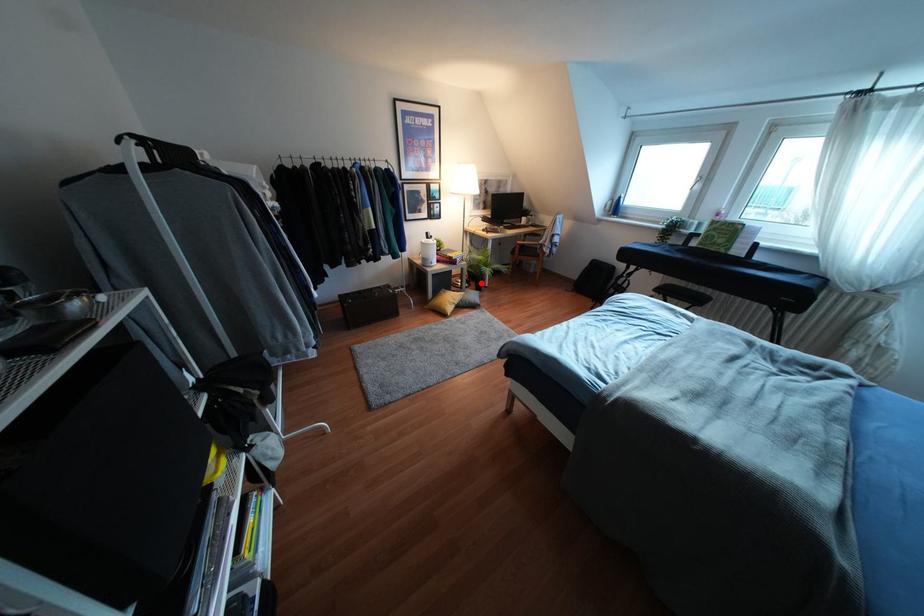
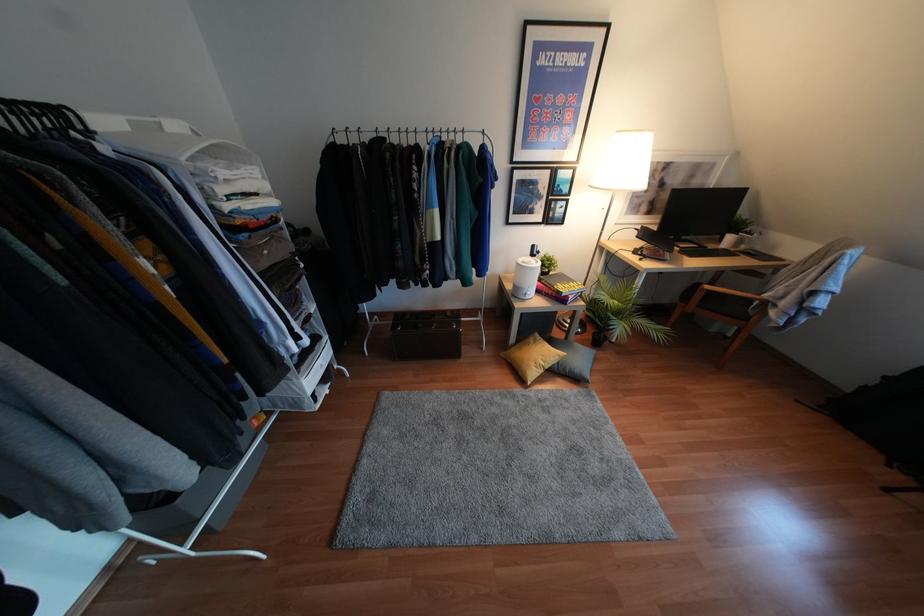
Question: I am providing you with two images of the same scene from different viewpoints. A red point is marked on the first image. Is the red point's position out of view in image 2?

Choices:
 (A) Yes
 (B) No

Answer: (B)